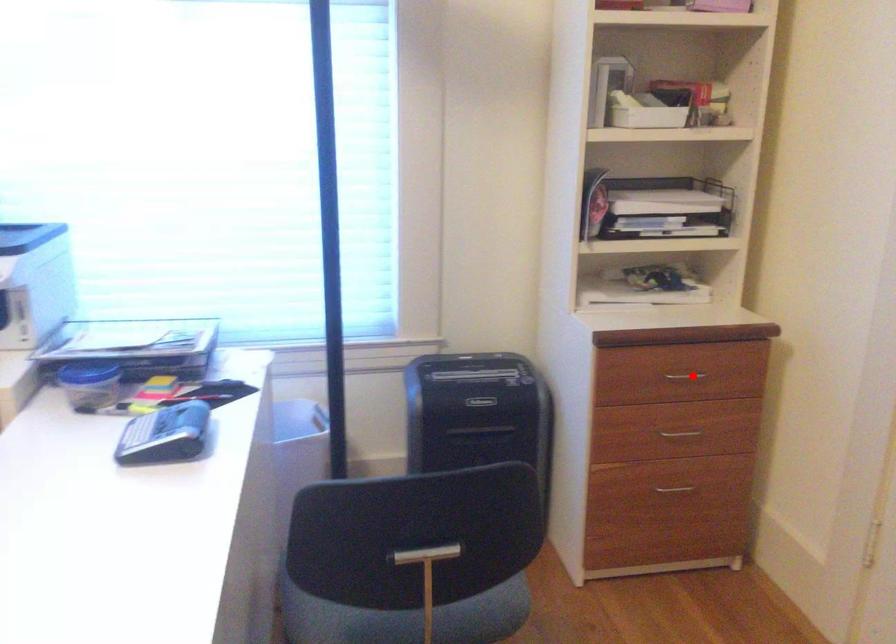
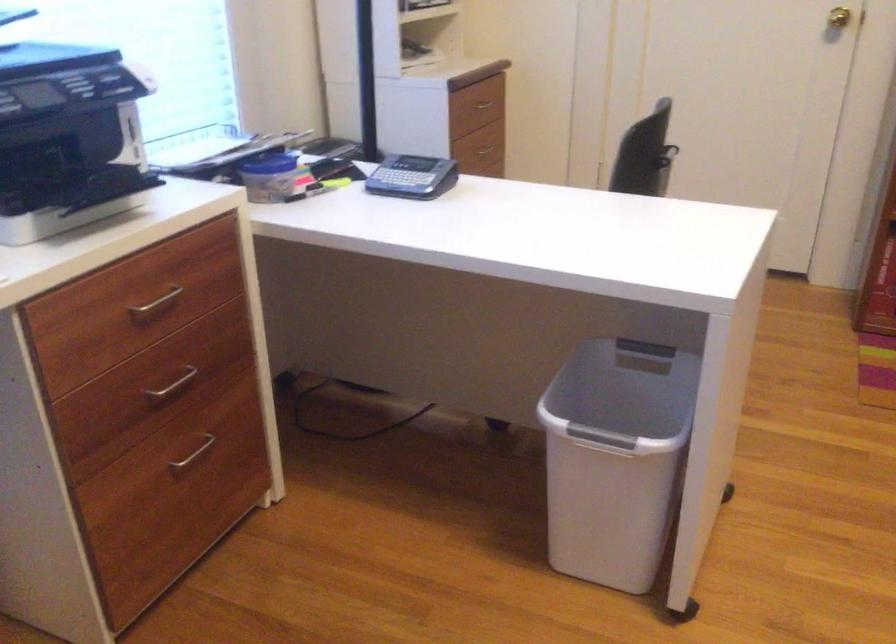
Locate, in the second image, the point that corresponds to the highlighted location in the first image.

(484, 104)